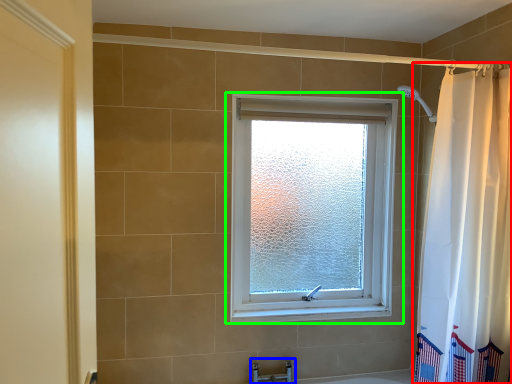
Question: Considering the real-world distances, which object is farthest from curtain (highlighted by a red box)? faucet (highlighted by a blue box) or window (highlighted by a green box)?

Choices:
 (A) faucet
 (B) window

Answer: (A)